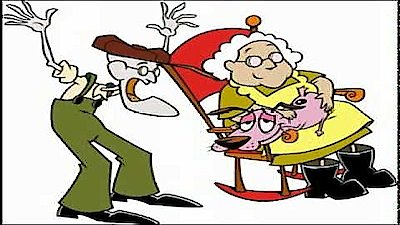
At what (x,y) coordinates should I click in order to perform the action: click on rocking chair. Please return your answer as a coordinate pair (x, y). The height and width of the screenshot is (225, 400). Looking at the image, I should click on (199, 46).